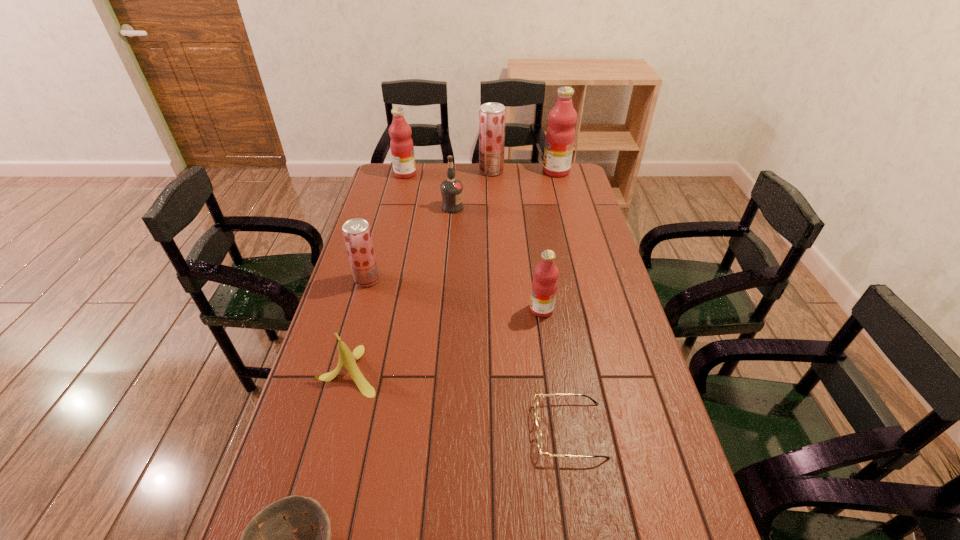
Identify the location of vacant space located on the front label of the fifth object from right to left. (500, 207).

The width and height of the screenshot is (960, 540). In order to click on free point located 0.100m on the label of the nearest fruit juice in this screenshot , I will do `click(497, 309)`.

The width and height of the screenshot is (960, 540). I want to click on vacant space located 0.090m on the label of the nearest fruit juice, so click(x=501, y=309).

You are a GUI agent. You are given a task and a screenshot of the screen. Output one action in this format:
    pyautogui.click(x=<x>, y=<y>)
    Task: Click on the vacant region located 0.050m on the label of the nearest fruit juice
    The height and width of the screenshot is (540, 960).
    Given the screenshot: What is the action you would take?
    pyautogui.click(x=514, y=309)

I want to click on free space located on the right of the smaller strawberry fruit juice, so click(x=410, y=280).

Identify the location of vacant space situated on the front of the third shortest object. (332, 434).

I want to click on free spot located 0.400m on the lenses of the second nearest object, so click(x=372, y=430).

Locate an element on the screen. This screenshot has width=960, height=540. vacant space located on the lenses of the second nearest object is located at coordinates (457, 430).

You are a GUI agent. You are given a task and a screenshot of the screen. Output one action in this format:
    pyautogui.click(x=<x>, y=<y>)
    Task: Click on the vacant region located 0.100m on the lenses of the second nearest object
    The width and height of the screenshot is (960, 540).
    Given the screenshot: What is the action you would take?
    pyautogui.click(x=493, y=430)

At what (x,y) coordinates should I click in order to perform the action: click on banana present at the left edge. Please return your answer as a coordinate pair (x, y). Looking at the image, I should click on (348, 359).